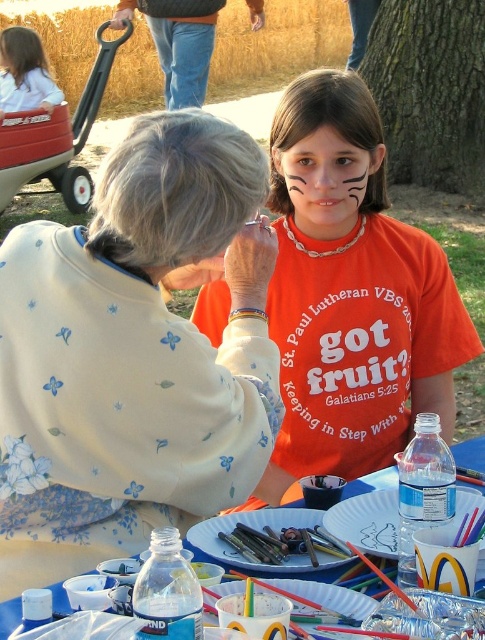
Which is behind, point (97, 451) or point (384, 372)?

The point (384, 372) is behind.

Does floral-patterned fabric at upper left appear on the right side of orange matte shirt at center?

Incorrect, floral-patterned fabric at upper left is not on the right side of orange matte shirt at center.

Between point (119, 285) and point (286, 284), which one is positioned in front?

Point (119, 285) is in front.

Find the location of a particular element. floral-patterned fabric at upper left is located at coordinates (132, 355).

What do you see at coordinates (25, 72) in the screenshot? The width and height of the screenshot is (485, 640). I see `smooth white shirt at upper left` at bounding box center [25, 72].

Image resolution: width=485 pixels, height=640 pixels. What do you see at coordinates (25, 72) in the screenshot?
I see `smooth white shirt at upper left` at bounding box center [25, 72].

Where is `smooth white shirt at upper left`? This screenshot has height=640, width=485. smooth white shirt at upper left is located at coordinates (25, 72).

Does orange matte shirt at center appear on the right side of white paper plate at lower center?

Incorrect, orange matte shirt at center is not on the right side of white paper plate at lower center.

Looking at this image, is orange matte shirt at center thinner than white paper plate at lower center?

No.

Is point (309, 186) farther from viewer compared to point (466, 486)?

Yes, it is behind point (466, 486).

Identify the location of orange matte shirt at center. (351, 294).